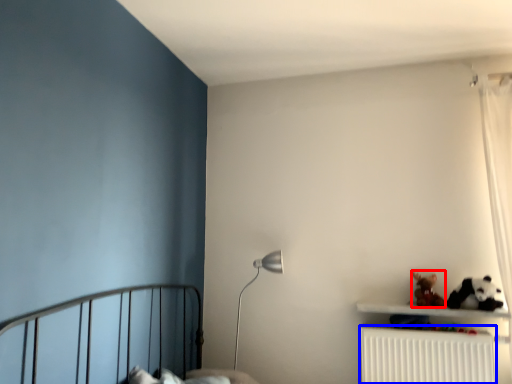
Question: Which point is closer to the camera, toy (highlighted by a red box) or radiator (highlighted by a blue box)?

Choices:
 (A) toy
 (B) radiator

Answer: (B)